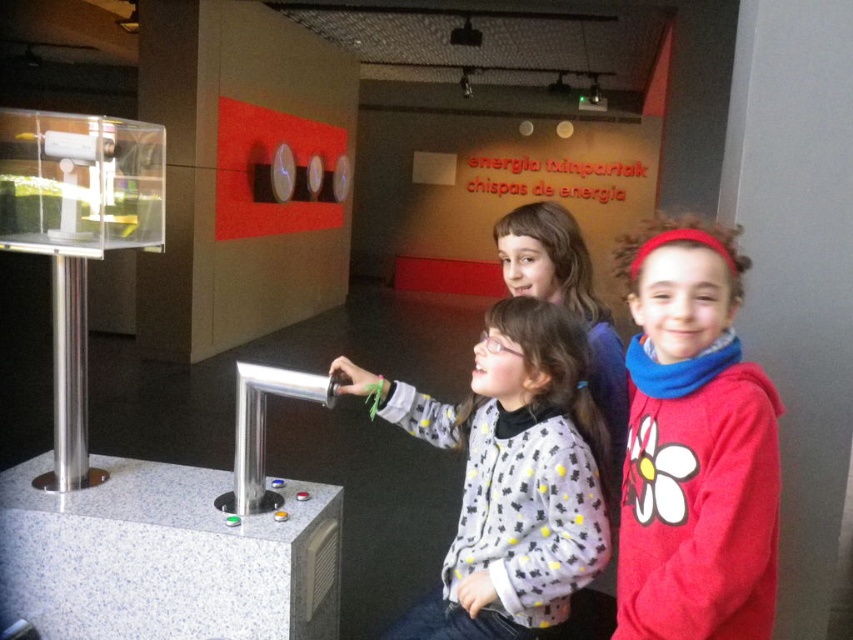
You are a GUI agent. You are given a task and a screenshot of the screen. Output one action in this format:
    pyautogui.click(x=<x>, y=<y>)
    Task: Click on the red fleece jacket at center right
    The image size is (853, 640).
    Given the screenshot: What is the action you would take?
    pyautogui.click(x=694, y=445)

Between point (723, 516) and point (515, 483), which one is positioned in front?

Point (723, 516) is more forward.

The width and height of the screenshot is (853, 640). I want to click on red fleece jacket at center right, so (694, 445).